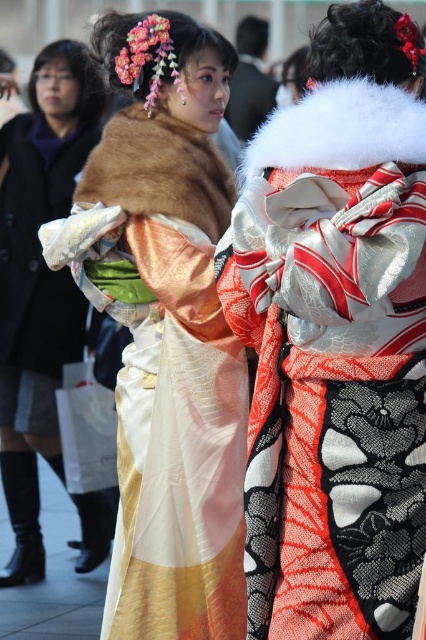
Does silky white kimono at center appear on the left side of fur coat at left?

Incorrect, silky white kimono at center is not on the left side of fur coat at left.

Can you confirm if silky white kimono at center is positioned below fur coat at left?

Yes.

You are a GUI agent. You are given a task and a screenshot of the screen. Output one action in this format:
    pyautogui.click(x=<x>, y=<y>)
    Task: Click on the silky white kimono at center
    
    Given the screenshot: What is the action you would take?
    pyautogui.click(x=166, y=328)

I want to click on silky white kimono at center, so click(x=166, y=328).

Between silky kimono at center and fur coat at left, which one appears on the left side from the viewer's perspective?

Positioned to the left is fur coat at left.

Is point (282, 490) in front of point (40, 92)?

Yes.

Locate an element on the screen. Image resolution: width=426 pixels, height=640 pixels. silky kimono at center is located at coordinates (336, 337).

Between silky kimono at center and silky white kimono at center, which one is positioned lower?

silky kimono at center is lower down.

Is silky kimono at center shorter than silky white kimono at center?

Correct, silky kimono at center is not as tall as silky white kimono at center.

This screenshot has height=640, width=426. Describe the element at coordinates (336, 337) in the screenshot. I see `silky kimono at center` at that location.

Find the location of a particular element. This screenshot has width=426, height=640. silky kimono at center is located at coordinates coord(336,337).